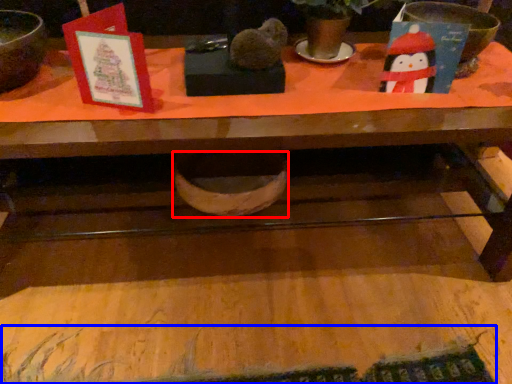
Question: Which point is closer to the camera, basin (highlighted by a red box) or writing (highlighted by a blue box)?

Choices:
 (A) basin
 (B) writing

Answer: (B)